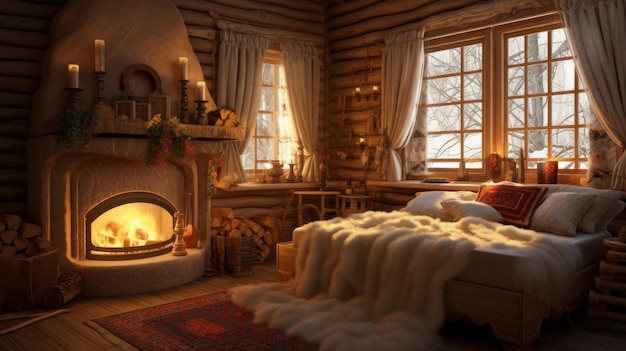
Where is `pillows`? The image size is (626, 351). pillows is located at coordinates (553, 208), (613, 212), (510, 199), (433, 194), (459, 208).